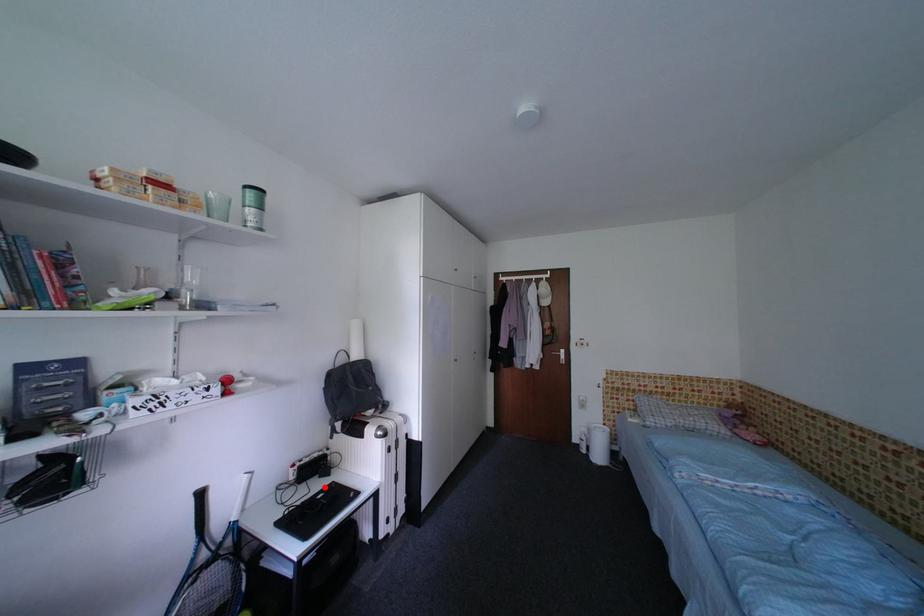
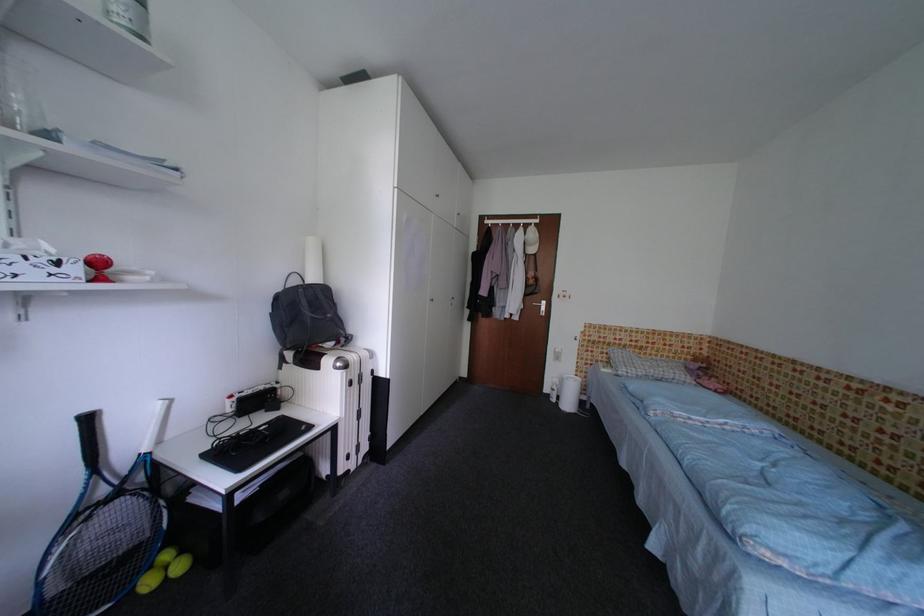
Find the pixel in the second image that matches the highlighted location in the first image.

(270, 421)